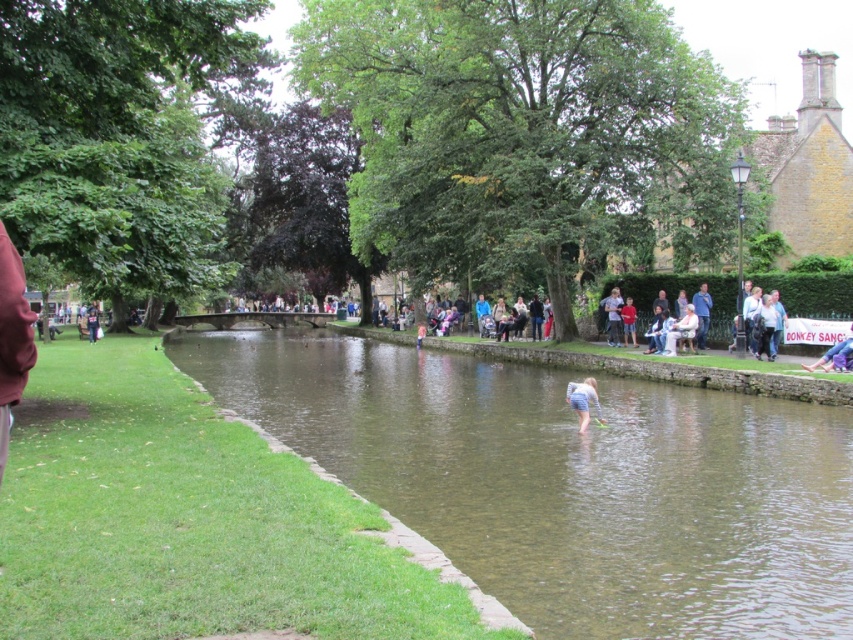
You are a photographer planning to capture a closeup of the blue denim shorts at lower center and the light blue denim shorts at center. Which of the two objects would require you to move closer to get a detailed shot?

The blue denim shorts at lower center occupies less space than light blue denim shorts at center, so you would need to move closer to the blue denim shorts at lower center to capture its details in the closeup.

You are standing on the riverside and see the clear water at center and the blue denim shorts at lower center. Which object is closer to the bottom of the image?

The blue denim shorts at lower center are closer to the bottom of the image because the clear water at center is below it.